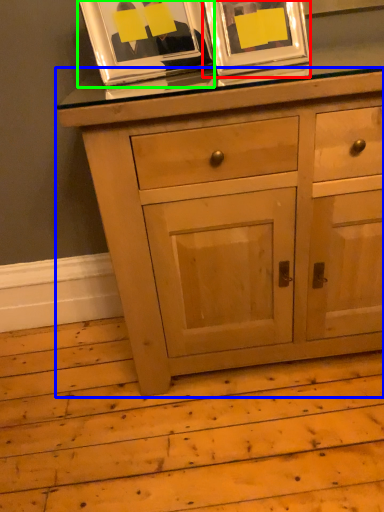
Question: Estimate the real-world distances between objects in this image. Which object is closer to picture frame (highlighted by a red box), chest of drawers (highlighted by a blue box) or picture frame (highlighted by a green box)?

Choices:
 (A) chest of drawers
 (B) picture frame

Answer: (B)